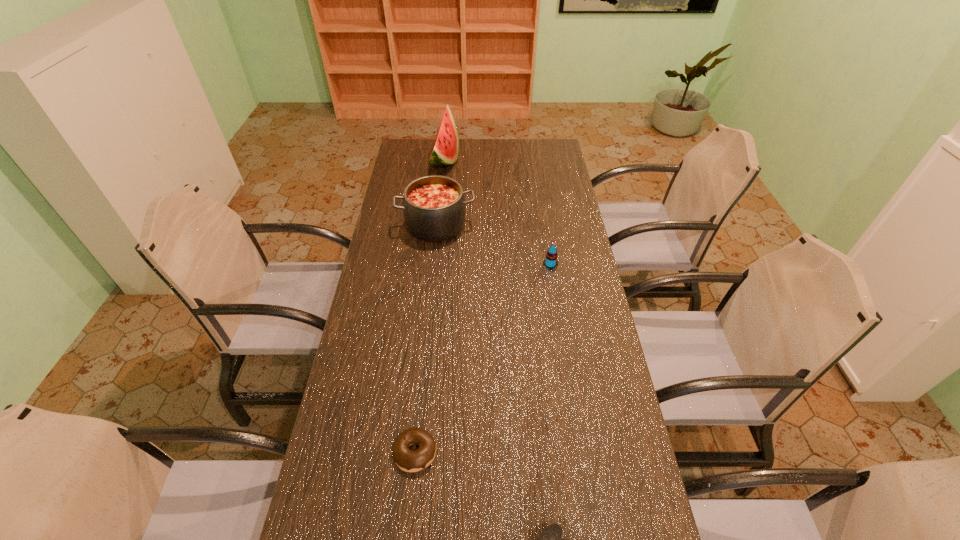
Where is `the farthest object`? The width and height of the screenshot is (960, 540). the farthest object is located at coordinates (445, 151).

Where is `the tallest object`? the tallest object is located at coordinates (445, 151).

I want to click on casserole, so click(x=434, y=206).

Locate an element on the screen. Image resolution: width=960 pixels, height=540 pixels. the second tallest object is located at coordinates (x=434, y=206).

This screenshot has width=960, height=540. I want to click on the third nearest object, so click(551, 261).

Identify the location of the third shortest object. The image size is (960, 540). (551, 261).

Find the location of a particular element. the shortest object is located at coordinates (407, 460).

Find the location of a particular element. The width and height of the screenshot is (960, 540). doughnut is located at coordinates (407, 460).

Image resolution: width=960 pixels, height=540 pixels. I want to click on free space located on the outer rind of the farthest object, so click(x=504, y=159).

Locate an element on the screen. This screenshot has height=540, width=960. free space located on the right of the fourth shortest object is located at coordinates (493, 225).